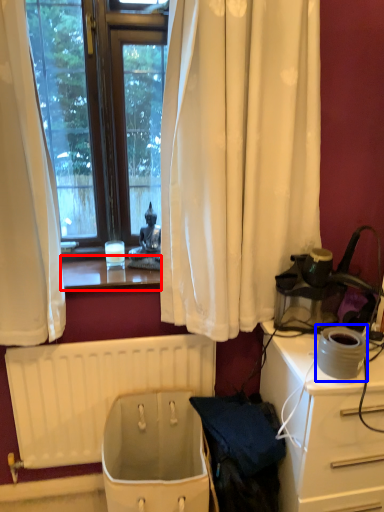
Question: Which object is closer to the camera taking this photo, window sill (highlighted by a red box) or appliance (highlighted by a blue box)?

Choices:
 (A) window sill
 (B) appliance

Answer: (B)